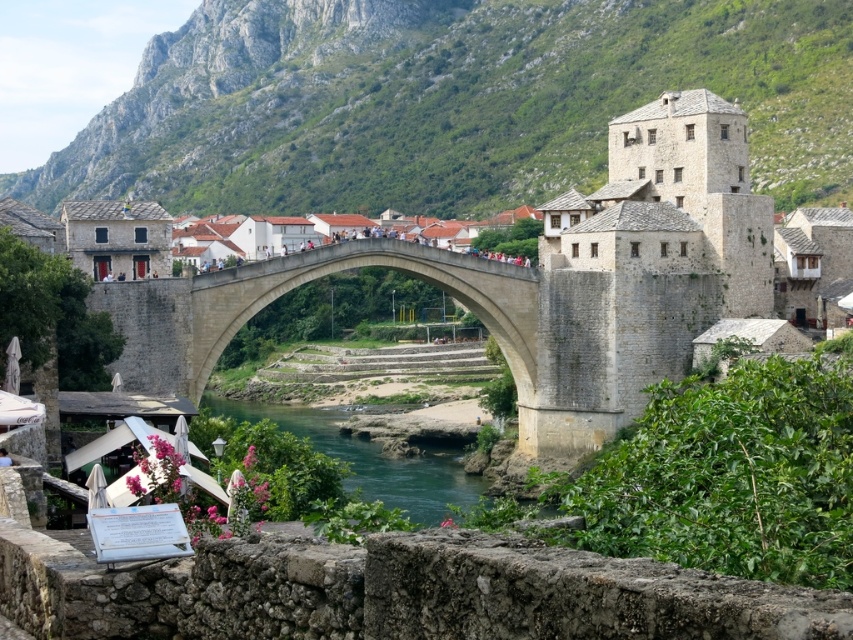
Does green stone mountain at upper center have a greater height compared to green stone river at center?

Correct, green stone mountain at upper center is much taller as green stone river at center.

Does point (547, 60) come behind point (299, 429)?

Yes.

Locate an element on the screen. This screenshot has height=640, width=853. green stone mountain at upper center is located at coordinates (448, 100).

Looking at this image, can you confirm if green stone mountain at upper center is positioned above stone arch bridge at center?

Yes, green stone mountain at upper center is above stone arch bridge at center.

Can you confirm if green stone mountain at upper center is shorter than stone arch bridge at center?

In fact, green stone mountain at upper center may be taller than stone arch bridge at center.

The height and width of the screenshot is (640, 853). What do you see at coordinates (448, 100) in the screenshot? I see `green stone mountain at upper center` at bounding box center [448, 100].

Find the location of a particular element. green stone mountain at upper center is located at coordinates (448, 100).

Which is below, stone arch bridge at center or green stone river at center?

Positioned lower is green stone river at center.

Does stone arch bridge at center have a lesser height compared to green stone river at center?

No.

At what (x,y) coordinates should I click in order to perform the action: click on stone arch bridge at center. Please return your answer as a coordinate pair (x, y). Looking at the image, I should click on (364, 266).

The height and width of the screenshot is (640, 853). I want to click on stone arch bridge at center, so click(x=364, y=266).